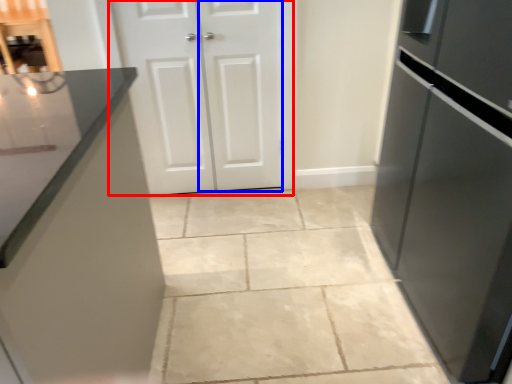
Question: Which object is closer to the camera taking this photo, door (highlighted by a red box) or door (highlighted by a blue box)?

Choices:
 (A) door
 (B) door

Answer: (A)